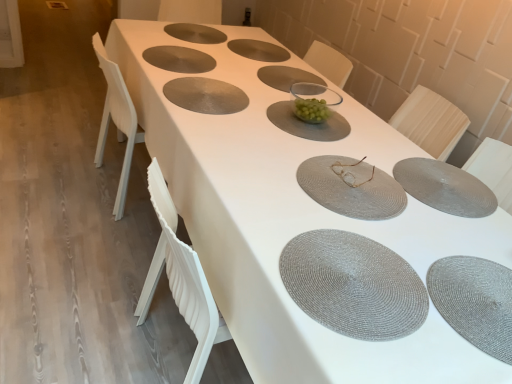
At what (x,y) coordinates should I click in order to perform the action: click on free spot in front of clear glass bowl at center, arranged as the 6th tableware when ordered from the bottom. Please return your answer as a coordinate pair (x, y). The width and height of the screenshot is (512, 384). Looking at the image, I should click on pos(296,130).